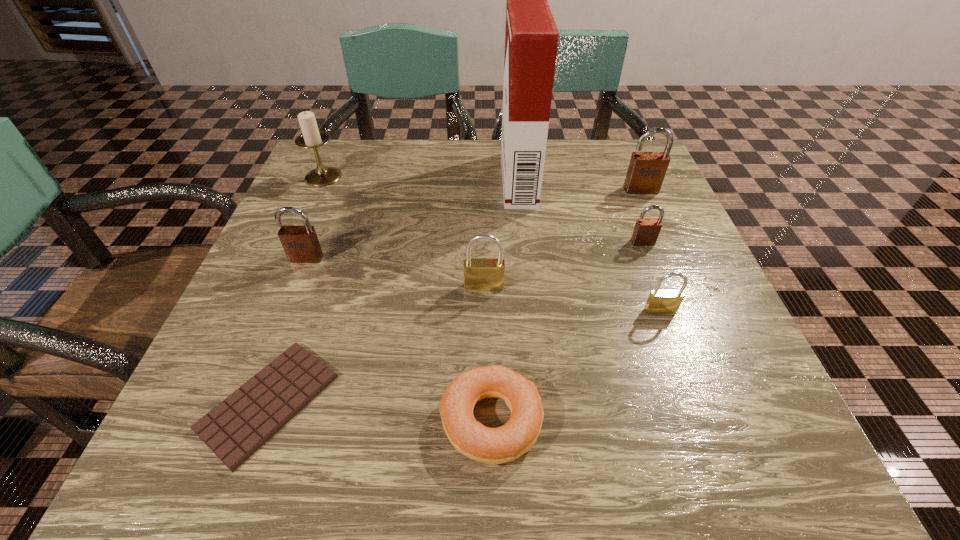
Locate an element on the screen. cigarette_case is located at coordinates (531, 38).

What are the coordinates of `red cigarette_case` in the screenshot? It's located at 531,38.

This screenshot has height=540, width=960. Identify the location of white candle holder. (311, 137).

Identify the location of the biggest brown padlock. This screenshot has height=540, width=960. (646, 172).

Image resolution: width=960 pixels, height=540 pixels. I want to click on the farthest padlock, so click(646, 172).

The image size is (960, 540). Find the location of `the fifth farthest object`. the fifth farthest object is located at coordinates (301, 245).

The image size is (960, 540). Identify the location of the nearest brown padlock. (301, 245).

Locate an element on the screen. This screenshot has height=540, width=960. the bigger brass padlock is located at coordinates (480, 274).

I want to click on the second nearest padlock, so click(480, 274).

Where is `the nearest padlock`? This screenshot has height=540, width=960. the nearest padlock is located at coordinates (664, 301).